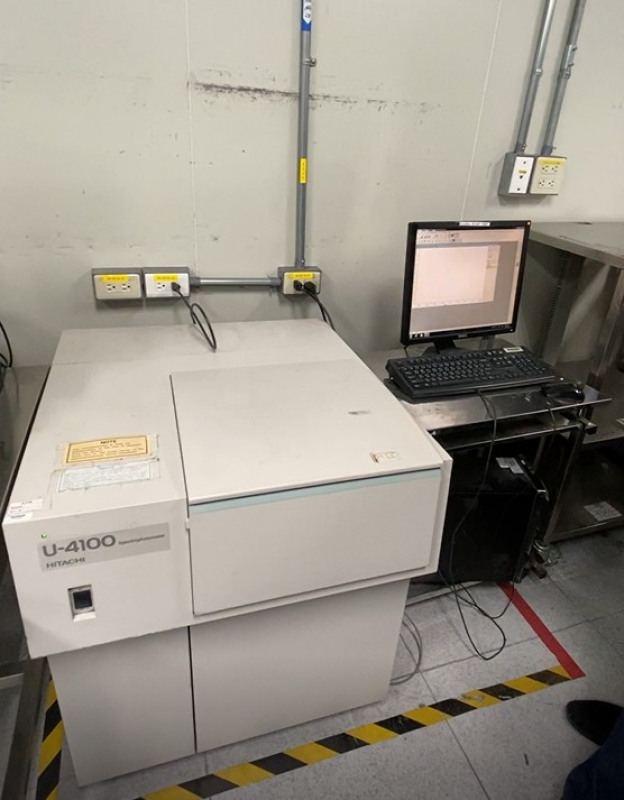
The image size is (624, 800). In order to click on floor in this screenshot , I will do `click(512, 740)`.